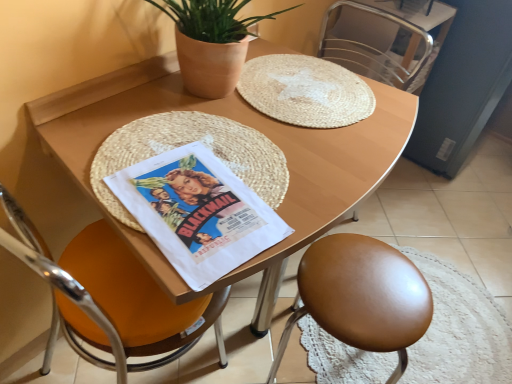
Question: Are orange leather chair at left, the 1th chair from the left, and wooden table at center located far from each other?

Choices:
 (A) yes
 (B) no

Answer: (B)

Question: Is the position of orange leather chair at left, the third chair positioned from the right, less distant than that of wooden table at center?

Choices:
 (A) yes
 (B) no

Answer: (A)

Question: Does orange leather chair at left, the third chair positioned from the right, contain wooden table at center?

Choices:
 (A) no
 (B) yes

Answer: (A)

Question: From a real-world perspective, is orange leather chair at left, the 1th chair from the left, positioned over wooden table at center based on gravity?

Choices:
 (A) yes
 (B) no

Answer: (A)

Question: Is orange leather chair at left, the third chair positioned from the right, outside wooden table at center?

Choices:
 (A) yes
 (B) no

Answer: (B)

Question: Considering the positions of point (399, 82) and point (220, 344), is point (399, 82) closer or farther from the camera than point (220, 344)?

Choices:
 (A) closer
 (B) farther

Answer: (B)

Question: Considering their positions, is metallic silver chair at upper right, positioned as the 1th chair in right-to-left order, located in front of or behind orange leather chair at left, the third chair positioned from the right?

Choices:
 (A) behind
 (B) front

Answer: (A)

Question: Would you say metallic silver chair at upper right, positioned as the 1th chair in right-to-left order, is to the left or to the right of orange leather chair at left, the 1th chair from the left, in the picture?

Choices:
 (A) right
 (B) left

Answer: (A)

Question: From a real-world perspective, relative to orange leather chair at left, the third chair positioned from the right, is metallic silver chair at upper right, the third chair from the left, vertically above or below?

Choices:
 (A) above
 (B) below

Answer: (A)

Question: From the image's perspective, is metallic silver chair at upper right, the third chair from the left, positioned above or below white paper comic book at center?

Choices:
 (A) above
 (B) below

Answer: (A)

Question: From a real-world perspective, relative to white paper comic book at center, is metallic silver chair at upper right, the third chair from the left, vertically above or below?

Choices:
 (A) below
 (B) above

Answer: (A)

Question: Is metallic silver chair at upper right, positioned as the 1th chair in right-to-left order, in front of or behind white paper comic book at center in the image?

Choices:
 (A) front
 (B) behind

Answer: (B)

Question: In terms of height, does metallic silver chair at upper right, positioned as the 1th chair in right-to-left order, look taller or shorter compared to white paper comic book at center?

Choices:
 (A) short
 (B) tall

Answer: (B)

Question: Is white paper comic book at center inside the boundaries of orange leather chair at left, the 1th chair from the left, or outside?

Choices:
 (A) outside
 (B) inside

Answer: (B)

Question: From their relative heights in the image, would you say white paper comic book at center is taller or shorter than orange leather chair at left, the 1th chair from the left?

Choices:
 (A) short
 (B) tall

Answer: (A)